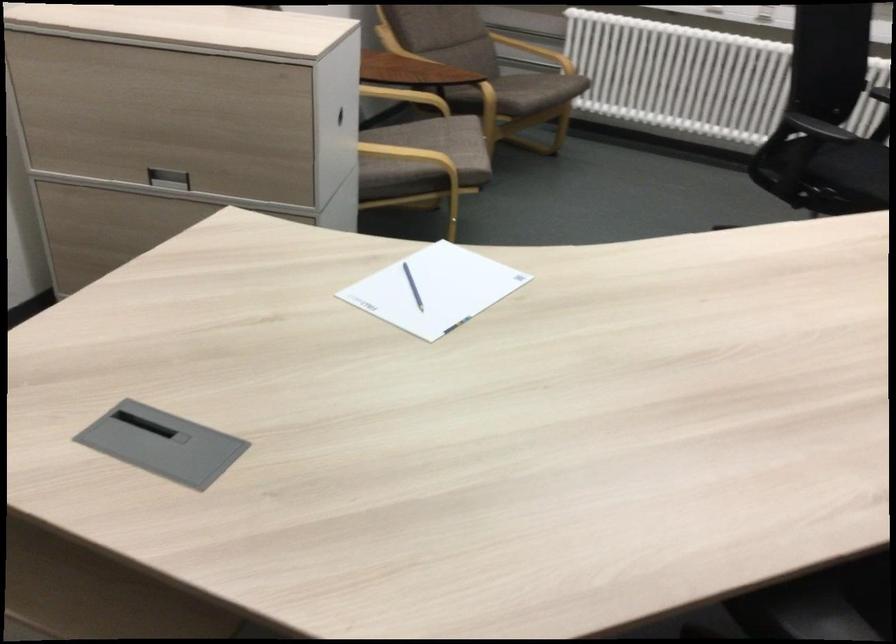
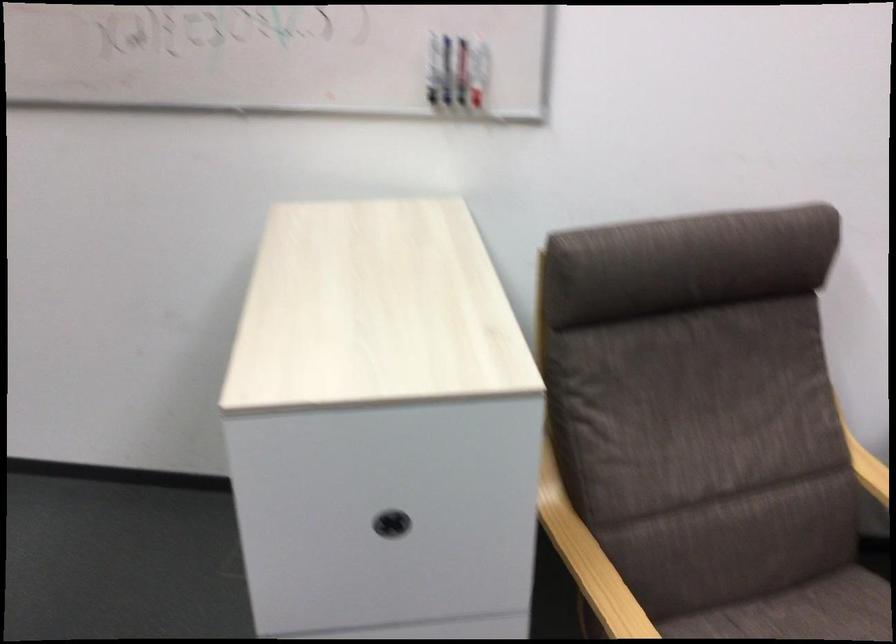
The point at (340, 118) is marked in the first image. Where is the corresponding point in the second image?

(391, 524)